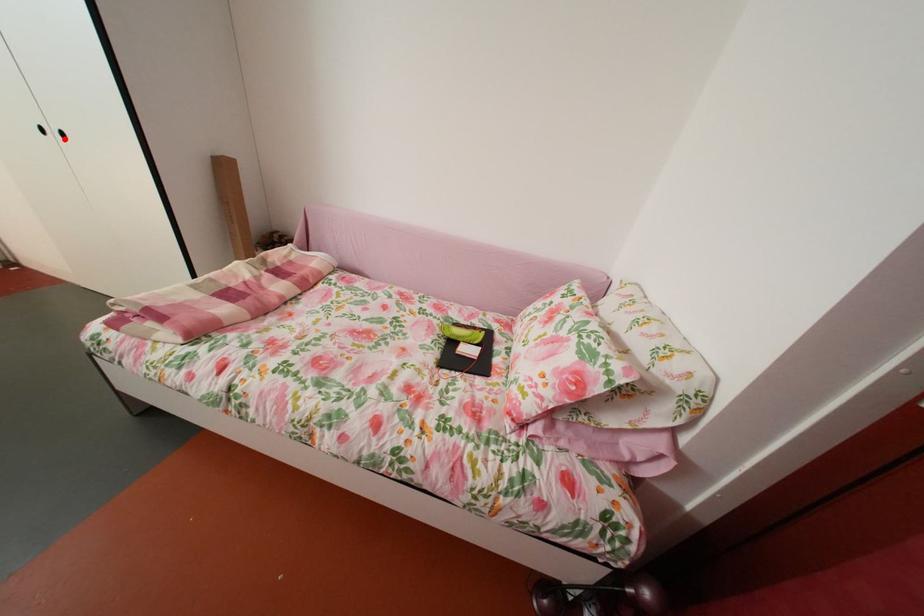
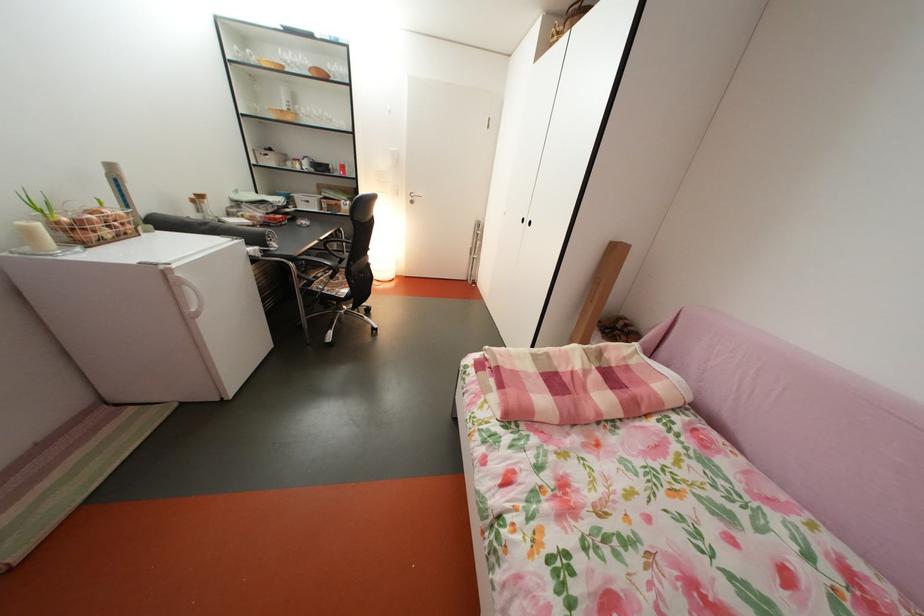
Question: I am providing you with two images of the same scene from different viewpoints. A red point is shown in image1. For the corresponding object point in image2, is it positioned nearer or farther from the camera?

Choices:
 (A) Nearer
 (B) Farther

Answer: (B)